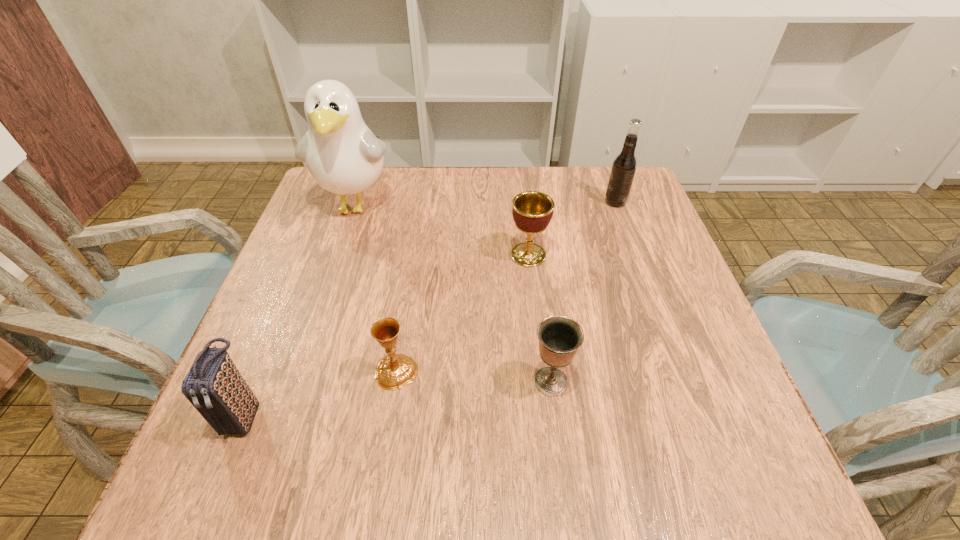
I want to click on vacant space situated on the left of the farthest chalice, so click(x=483, y=255).

I want to click on free space located 0.160m on the right of the fourth object from right to left, so click(x=507, y=372).

The height and width of the screenshot is (540, 960). Identify the location of gull situated at the far edge. (343, 156).

Identify the location of root beer present at the far edge. (624, 166).

Locate an element on the screen. This screenshot has height=540, width=960. object at the near edge is located at coordinates (214, 386).

Locate an element on the screen. The width and height of the screenshot is (960, 540). gull present at the left edge is located at coordinates (343, 156).

This screenshot has height=540, width=960. Find the location of `clutch bag located at the left edge`. clutch bag located at the left edge is located at coordinates (214, 386).

Identify the location of object located at the right edge. This screenshot has width=960, height=540. pyautogui.click(x=624, y=166).

You are a GUI agent. You are given a task and a screenshot of the screen. Output one action in this format:
    pyautogui.click(x=<x>, y=<y>)
    Task: Click on the object that is at the far left corner
    
    Given the screenshot: What is the action you would take?
    pyautogui.click(x=343, y=156)

Where is `object located in the near left corner section of the desktop`? object located in the near left corner section of the desktop is located at coordinates click(214, 386).